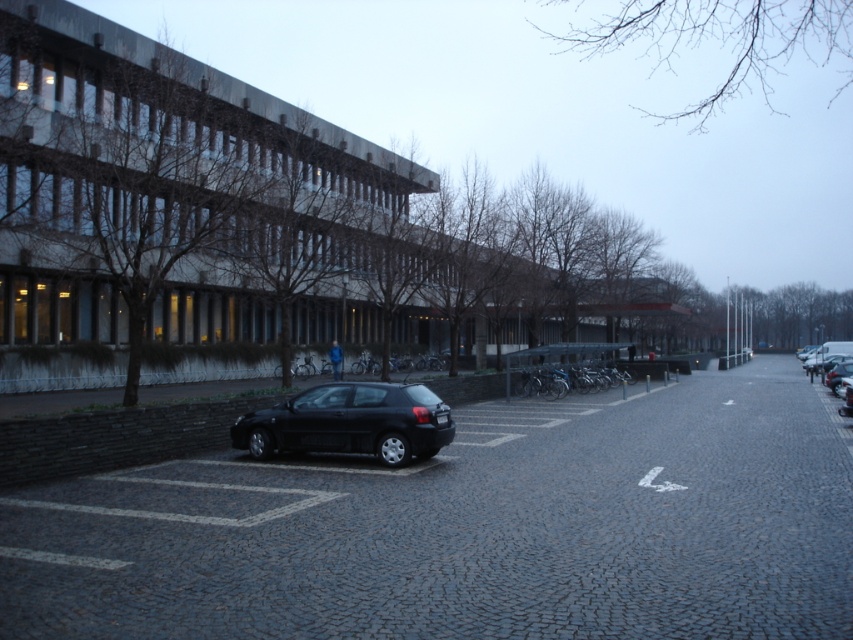
Question: Among these objects, which one is farthest from the camera?

Choices:
 (A) shiny black car at center-left
 (B) metallic silver car at right
 (C) shiny black hatchback at center

Answer: (B)

Question: From the image, what is the correct spatial relationship of shiny black car at center-left in relation to shiny black hatchback at center?

Choices:
 (A) right
 (B) left

Answer: (A)

Question: Considering the relative positions of shiny black hatchback at center and metallic silver car at right in the image provided, where is shiny black hatchback at center located with respect to metallic silver car at right?

Choices:
 (A) right
 (B) left

Answer: (B)

Question: Is shiny black car at center-left in front of shiny black hatchback at center?

Choices:
 (A) yes
 (B) no

Answer: (A)

Question: Which object appears farthest from the camera in this image?

Choices:
 (A) shiny black car at center-left
 (B) shiny black hatchback at center
 (C) metallic silver car at right

Answer: (C)

Question: Which point is closer to the camera?

Choices:
 (A) metallic silver car at right
 (B) shiny black car at center-left

Answer: (B)